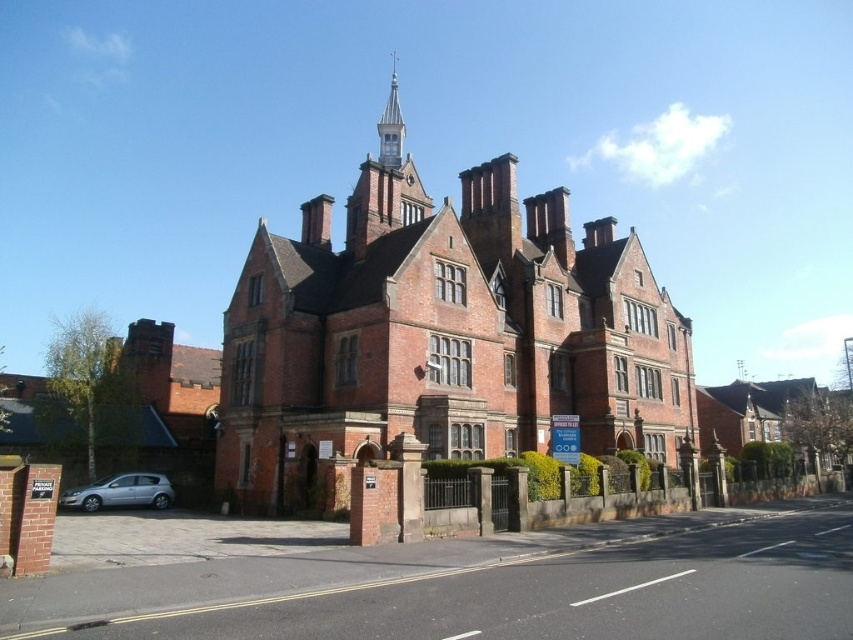
Is silver metallic hatchback at lower left positioned at the back of silver metallic spire at upper center?

No.

Is point (163, 476) behind point (393, 99)?

No, (163, 476) is in front of (393, 99).

Find the location of a particular element. This screenshot has width=853, height=640. silver metallic hatchback at lower left is located at coordinates (120, 492).

Is red brick church at center wider than silver metallic hatchback at lower left?

Correct, the width of red brick church at center exceeds that of silver metallic hatchback at lower left.

In the scene shown: Does red brick church at center appear over silver metallic hatchback at lower left?

Yes, red brick church at center is above silver metallic hatchback at lower left.

Does point (450, 324) lie in front of point (146, 497)?

Yes.

Where is `red brick church at center`? The width and height of the screenshot is (853, 640). red brick church at center is located at coordinates (442, 339).

Is red brick church at center closer to the viewer compared to silver metallic spire at upper center?

Yes.

Does point (474, 429) come closer to viewer compared to point (393, 112)?

Yes, it is.

Identify the location of red brick church at center. (442, 339).